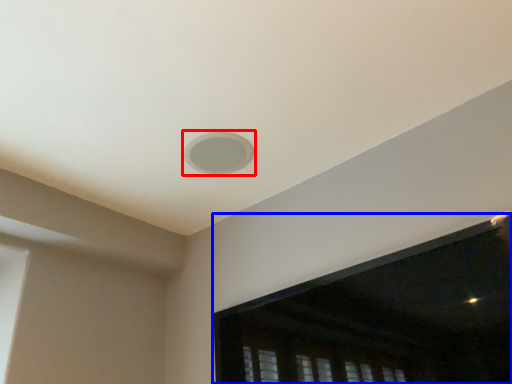
Question: Which of the following is the closest to the observer, hole (highlighted by a red box) or window screen (highlighted by a blue box)?

Choices:
 (A) hole
 (B) window screen

Answer: (B)